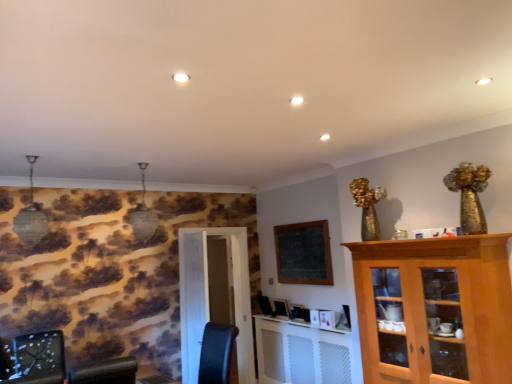
Question: From the image's perspective, would you say wooden table at lower center is shown under light brown wooden cabinet at right?

Choices:
 (A) no
 (B) yes

Answer: (B)

Question: Does wooden table at lower center have a greater height compared to light brown wooden cabinet at right?

Choices:
 (A) yes
 (B) no

Answer: (B)

Question: Considering the relative sizes of wooden table at lower center and light brown wooden cabinet at right in the image provided, is wooden table at lower center shorter than light brown wooden cabinet at right?

Choices:
 (A) no
 (B) yes

Answer: (B)

Question: From a real-world perspective, is wooden table at lower center under light brown wooden cabinet at right?

Choices:
 (A) yes
 (B) no

Answer: (A)

Question: Is wooden table at lower center facing away from light brown wooden cabinet at right?

Choices:
 (A) no
 (B) yes

Answer: (A)

Question: Which is correct: wooden table at lower center is inside light brown wooden cabinet at right, or outside of it?

Choices:
 (A) inside
 (B) outside

Answer: (B)

Question: Is wooden table at lower center wider or thinner than light brown wooden cabinet at right?

Choices:
 (A) wide
 (B) thin

Answer: (B)

Question: From their relative heights in the image, would you say wooden table at lower center is taller or shorter than light brown wooden cabinet at right?

Choices:
 (A) short
 (B) tall

Answer: (A)

Question: Considering the relative positions of wooden table at lower center and light brown wooden cabinet at right in the image provided, is wooden table at lower center to the left or to the right of light brown wooden cabinet at right?

Choices:
 (A) left
 (B) right

Answer: (A)

Question: Based on their sizes in the image, would you say white mesh radiator at lower center is bigger or smaller than wooden table at lower center?

Choices:
 (A) big
 (B) small

Answer: (A)

Question: Considering the relative positions of white mesh radiator at lower center and wooden table at lower center in the image provided, is white mesh radiator at lower center to the left or to the right of wooden table at lower center?

Choices:
 (A) left
 (B) right

Answer: (B)

Question: Relative to wooden table at lower center, is white mesh radiator at lower center in front or behind?

Choices:
 (A) behind
 (B) front

Answer: (A)

Question: Which is correct: white mesh radiator at lower center is inside wooden table at lower center, or outside of it?

Choices:
 (A) outside
 (B) inside

Answer: (A)

Question: Is point (468, 349) closer or farther from the camera than point (206, 258)?

Choices:
 (A) farther
 (B) closer

Answer: (B)

Question: Is light brown wooden cabinet at right bigger or smaller than white glossy door at center?

Choices:
 (A) big
 (B) small

Answer: (A)